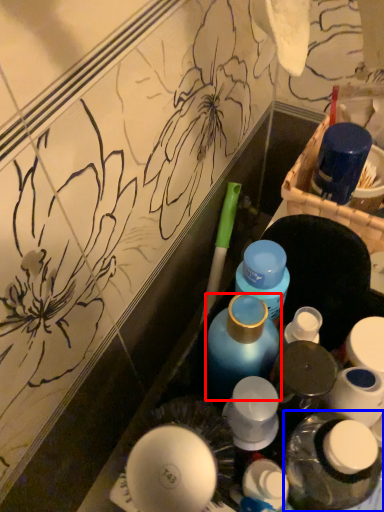
Question: Among these objects, which one is farthest to the camera, bottle (highlighted by a red box) or bottle (highlighted by a blue box)?

Choices:
 (A) bottle
 (B) bottle

Answer: (A)